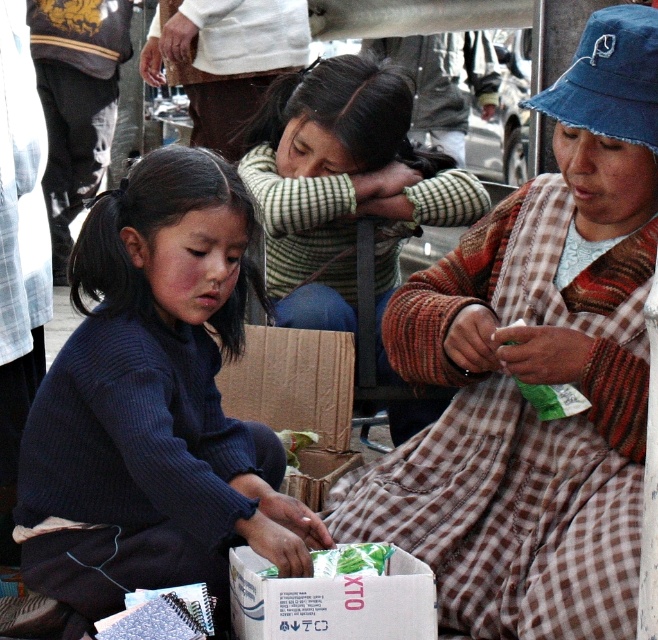
You are a photographer trying to capture a clear shot of the dark blue sweater at center and the white cardboard box at center. Based on their sizes, which one should you zoom in on more to ensure both are visible in the frame?

The dark blue sweater at center is taller than the white cardboard box at center, so you should zoom in more on the dark blue sweater at center to ensure both fit in the frame.

You are a photographer trying to capture a group photo of the dark blue sweater at center and the striped sweater at center. Which one should you adjust to be closer to the camera to ensure both are in focus?

The dark blue sweater at center is not as tall as striped sweater at center, so you should move the dark blue sweater at center closer to the camera to ensure both are in focus.

You are a fashion designer observing the scene. You notice two items of clothing at the center of the image. Which one is taller between the brown checkered dress at center and the striped sweater at center?

The brown checkered dress at center is taller than the striped sweater at center.